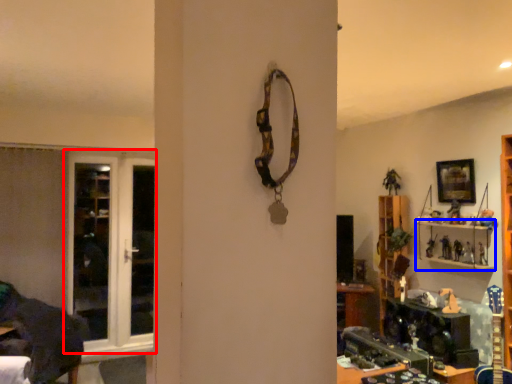
Question: Which object appears farthest to the camera in this image, door (highlighted by a red box) or shelf (highlighted by a blue box)?

Choices:
 (A) door
 (B) shelf

Answer: (A)